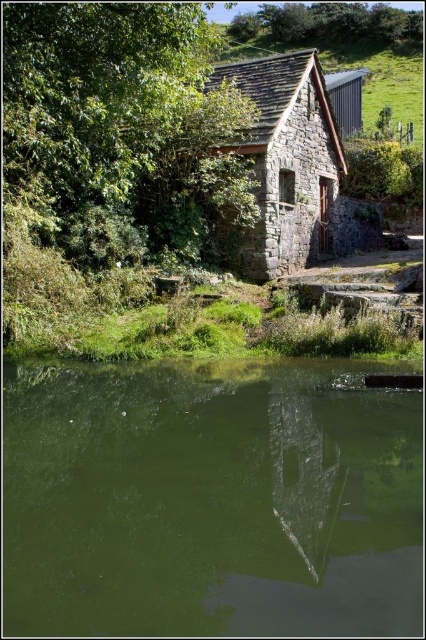
Question: Which of the following is the closest to the observer?

Choices:
 (A) green leafy tree at upper left
 (B) rustic stone cottage at center
 (C) green leafy tree at upper center
 (D) green reflective water at center

Answer: (D)

Question: Can you confirm if green leafy tree at upper left is bigger than rustic stone cottage at center?

Choices:
 (A) no
 (B) yes

Answer: (A)

Question: Among these objects, which one is farthest from the camera?

Choices:
 (A) green leafy tree at upper left
 (B) green leafy tree at upper center

Answer: (B)

Question: Among these objects, which one is farthest from the camera?

Choices:
 (A) green reflective water at center
 (B) rustic stone cottage at center
 (C) green leafy tree at upper left

Answer: (B)

Question: Does green reflective water at center have a greater width compared to green leafy tree at upper center?

Choices:
 (A) no
 (B) yes

Answer: (A)

Question: Does green leafy tree at upper left have a larger size compared to green leafy tree at upper center?

Choices:
 (A) yes
 (B) no

Answer: (B)